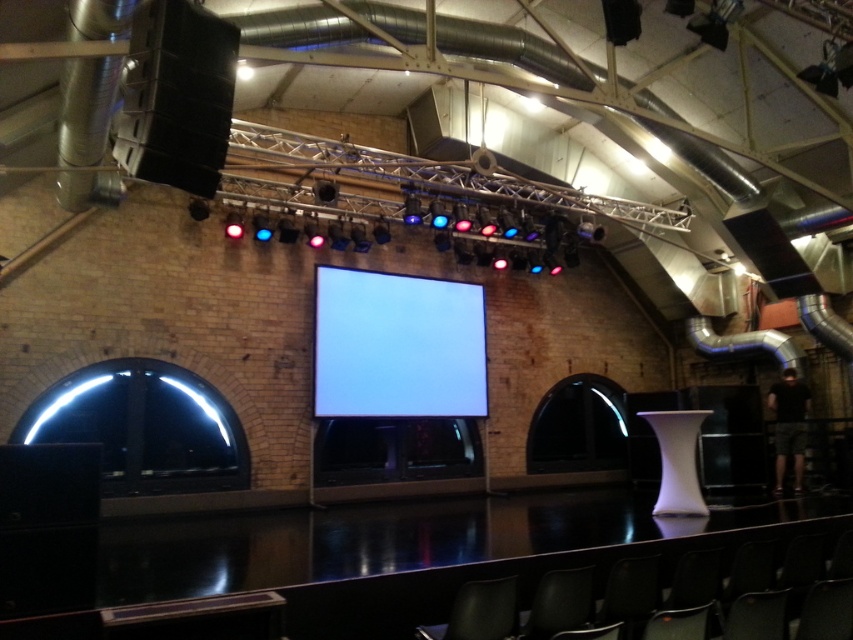
Question: Which object is farther from the camera taking this photo?

Choices:
 (A) matte black chair at lower center
 (B) white glossy projection screen at center

Answer: (B)

Question: Does white glossy projection screen at center have a smaller size compared to matte black chair at lower center?

Choices:
 (A) yes
 (B) no

Answer: (B)

Question: Does white glossy projection screen at center have a greater width compared to matte black chair at lower center?

Choices:
 (A) yes
 (B) no

Answer: (A)

Question: Which point is farther from the camera taking this photo?

Choices:
 (A) (370, 401)
 (B) (466, 628)

Answer: (A)

Question: Does white glossy projection screen at center appear over matte black chair at lower center?

Choices:
 (A) no
 (B) yes

Answer: (B)

Question: Among these points, which one is nearest to the camera?

Choices:
 (A) (318, 413)
 (B) (462, 620)

Answer: (B)